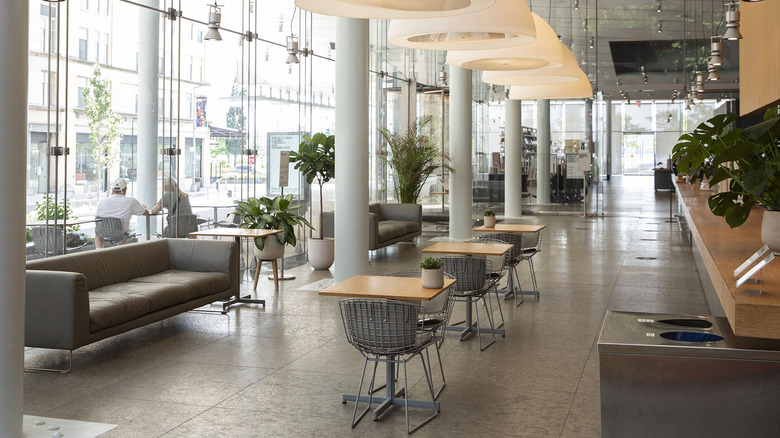
Where is `couch cushions`? The width and height of the screenshot is (780, 438). couch cushions is located at coordinates (122, 306), (168, 286), (192, 278), (383, 236), (399, 231), (412, 228).